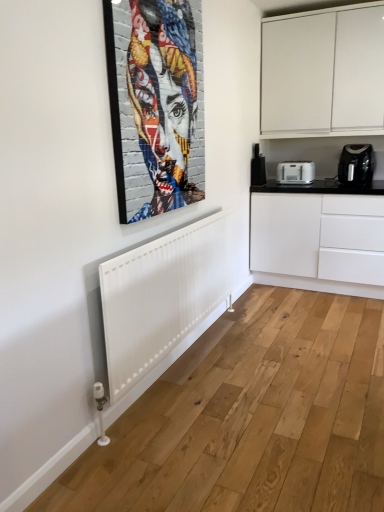
Where is `black plastic coffee machine at right`? The width and height of the screenshot is (384, 512). black plastic coffee machine at right is located at coordinates (257, 167).

Locate an element on the screen. This screenshot has height=512, width=384. black glossy countertop at right is located at coordinates (318, 242).

Locate an element on the screen. This screenshot has width=384, height=512. colorful mosaic portrait at upper center is located at coordinates (164, 98).

From a real-world perspective, is colorful mosaic portrait at upper center below black plastic coffee machine at right?

No.

How much distance is there between colorful mosaic portrait at upper center and black plastic coffee machine at right?

A: colorful mosaic portrait at upper center is 5.25 feet from black plastic coffee machine at right.

Is colorful mosaic portrait at upper center taller or shorter than black plastic coffee machine at right?

Considering their sizes, colorful mosaic portrait at upper center has more height than black plastic coffee machine at right.

Between colorful mosaic portrait at upper center and black plastic coffee machine at right, which one has smaller size?

black plastic coffee machine at right.

Which object is positioned more to the right, white matte cabinet at upper right or black glossy countertop at right?

black glossy countertop at right is more to the right.

From the image's perspective, which is below, white matte cabinet at upper right or black glossy countertop at right?

From the image's view, black glossy countertop at right is below.

Is point (288, 27) less distant than point (278, 234)?

Yes, it is in front of point (278, 234).

Is white matte cabinet at upper right spatially inside white plastic toaster at center-right, marked as the 1th home appliance in a left-to-right arrangement, or outside of it?

white matte cabinet at upper right is not inside white plastic toaster at center-right, marked as the 1th home appliance in a left-to-right arrangement, it's outside.

Considering the relative positions of white matte cabinet at upper right and white plastic toaster at center-right, which is the 2th home appliance from right to left, in the image provided, is white matte cabinet at upper right to the right of white plastic toaster at center-right, which is the 2th home appliance from right to left, from the viewer's perspective?

Yes, white matte cabinet at upper right is to the right of white plastic toaster at center-right, which is the 2th home appliance from right to left.

Which of these two, white matte cabinet at upper right or white plastic toaster at center-right, marked as the 1th home appliance in a left-to-right arrangement, is smaller?

With smaller size is white plastic toaster at center-right, marked as the 1th home appliance in a left-to-right arrangement.

Would you say black plastic coffee maker at right, which is counted as the second home appliance, starting from the left, is part of colorful mosaic portrait at upper center's contents?

Actually, black plastic coffee maker at right, which is counted as the second home appliance, starting from the left, is outside colorful mosaic portrait at upper center.

From the picture: Considering the sizes of objects colorful mosaic portrait at upper center and black plastic coffee maker at right, which is counted as the second home appliance, starting from the left, in the image provided, who is shorter, colorful mosaic portrait at upper center or black plastic coffee maker at right, which is counted as the second home appliance, starting from the left,?

With less height is black plastic coffee maker at right, which is counted as the second home appliance, starting from the left.

Considering the relative sizes of colorful mosaic portrait at upper center and black plastic coffee maker at right, which is counted as the second home appliance, starting from the left, in the image provided, is colorful mosaic portrait at upper center thinner than black plastic coffee maker at right, which is counted as the second home appliance, starting from the left,?

Yes.

From the picture: From a real-world perspective, is black plastic coffee machine at right physically located above or below black glossy countertop at right?

Clearly, from a real-world perspective, black plastic coffee machine at right is above black glossy countertop at right.

Based on the photo, could you tell me if black plastic coffee machine at right is turned towards black glossy countertop at right?

No, black plastic coffee machine at right is not turned towards black glossy countertop at right.

Considering the positions of point (252, 173) and point (279, 239), is point (252, 173) closer or farther from the camera than point (279, 239)?

Point (252, 173) appears to be farther away from the viewer than point (279, 239).

Considering the relative sizes of black plastic coffee machine at right and black glossy countertop at right in the image provided, is black plastic coffee machine at right smaller than black glossy countertop at right?

Correct, black plastic coffee machine at right occupies less space than black glossy countertop at right.

Can you confirm if black glossy countertop at right is positioned to the left of colorful mosaic portrait at upper center?

No.

Is black glossy countertop at right far away from colorful mosaic portrait at upper center?

black glossy countertop at right is far away from colorful mosaic portrait at upper center.

Between black glossy countertop at right and colorful mosaic portrait at upper center, which one has more height?

With more height is colorful mosaic portrait at upper center.

Locate an element on the screen. The height and width of the screenshot is (512, 384). counter top below the colorful mosaic portrait at upper center (from the image's perspective) is located at coordinates (318, 242).

In the scene shown: Choose the correct answer: Is black glossy countertop at right inside black plastic coffee maker at right, which is counted as the second home appliance, starting from the left, or outside it?

black glossy countertop at right is not enclosed by black plastic coffee maker at right, which is counted as the second home appliance, starting from the left.

Is black glossy countertop at right next to black plastic coffee maker at right, which is counted as the 1th home appliance, starting from the right?

No, black glossy countertop at right is not beside black plastic coffee maker at right, which is counted as the 1th home appliance, starting from the right.

Consider the image. Which of these two, black glossy countertop at right or black plastic coffee maker at right, which is counted as the 1th home appliance, starting from the right, stands taller?

black glossy countertop at right is taller.

From a real-world perspective, is black glossy countertop at right under black plastic coffee maker at right, which is counted as the 1th home appliance, starting from the right?

Yes, from a real-world perspective, black glossy countertop at right is beneath black plastic coffee maker at right, which is counted as the 1th home appliance, starting from the right.

Find the location of a particular element. The image size is (384, 512). person above the black plastic coffee machine at right (from a real-world perspective) is located at coordinates (164, 98).

Locate an element on the screen. The height and width of the screenshot is (512, 384). cabinetry lying in front of the black glossy countertop at right is located at coordinates click(x=323, y=71).

Based on the photo, from the image, which object appears to be farther from white matte cabinet at upper right, white plastic toaster at center-right, which is the 2th home appliance from right to left, or black plastic coffee maker at right, which is counted as the second home appliance, starting from the left?

white plastic toaster at center-right, which is the 2th home appliance from right to left.

From the image, which object appears to be farther from white matte cabinet at upper right, black plastic coffee maker at right, which is counted as the 1th home appliance, starting from the right, or black plastic coffee machine at right?

black plastic coffee machine at right.

When comparing their distances from white matte cabinet at upper right, does white plastic toaster at center-right, which is the 2th home appliance from right to left, or black plastic coffee machine at right seem closer?

black plastic coffee machine at right lies closer to white matte cabinet at upper right than the other object.

Which object lies nearer to the anchor point black glossy countertop at right, black plastic coffee machine at right or colorful mosaic portrait at upper center?

Among the two, black plastic coffee machine at right is located nearer to black glossy countertop at right.

When comparing their distances from colorful mosaic portrait at upper center, does white plastic toaster at center-right, which is the 2th home appliance from right to left, or black glossy countertop at right seem further?

Based on the image, white plastic toaster at center-right, which is the 2th home appliance from right to left, appears to be further to colorful mosaic portrait at upper center.

Based on their spatial positions, is white matte cabinet at upper right or black plastic coffee maker at right, which is counted as the 1th home appliance, starting from the right, closer to colorful mosaic portrait at upper center?

Among the two, white matte cabinet at upper right is located nearer to colorful mosaic portrait at upper center.

Based on their spatial positions, is colorful mosaic portrait at upper center or white matte cabinet at upper right closer to black glossy countertop at right?

white matte cabinet at upper right is positioned closer to the anchor black glossy countertop at right.

Considering their positions, is colorful mosaic portrait at upper center positioned closer to black glossy countertop at right than white plastic toaster at center-right, marked as the 1th home appliance in a left-to-right arrangement?

The object closer to black glossy countertop at right is white plastic toaster at center-right, marked as the 1th home appliance in a left-to-right arrangement.

In order to click on cabinetry between colorful mosaic portrait at upper center and black plastic coffee machine at right along the z-axis in this screenshot , I will do `click(323, 71)`.

Locate an element on the screen. Image resolution: width=384 pixels, height=512 pixels. cabinetry between colorful mosaic portrait at upper center and black plastic coffee maker at right, which is counted as the 1th home appliance, starting from the right, along the z-axis is located at coordinates (323, 71).

Find the location of a particular element. cabinetry located between colorful mosaic portrait at upper center and black glossy countertop at right in the depth direction is located at coordinates (323, 71).

The width and height of the screenshot is (384, 512). I want to click on home appliance that lies between white matte cabinet at upper right and white plastic toaster at center-right, marked as the 1th home appliance in a left-to-right arrangement, from top to bottom, so click(356, 164).